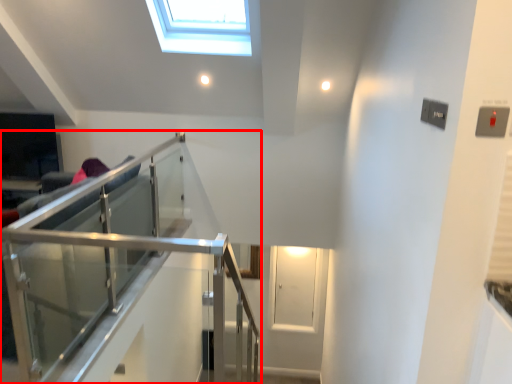
Question: From the image's perspective, where is balcony (annotated by the red box) located relative to glass door?

Choices:
 (A) below
 (B) above

Answer: (B)